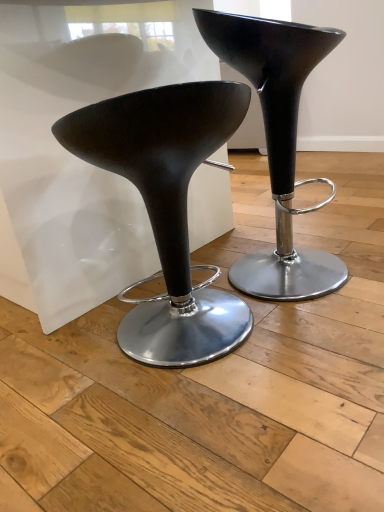
Question: From a real-world perspective, is glossy black stool at center, arranged as the second stool when viewed from the left, above or below matte black stool at center, placed as the 1th stool when sorted from left to right?

Choices:
 (A) below
 (B) above

Answer: (B)

Question: From their relative heights in the image, would you say glossy black stool at center, the 1th stool from the right, is taller or shorter than matte black stool at center, the second stool from the right?

Choices:
 (A) short
 (B) tall

Answer: (B)

Question: From the image's perspective, is glossy black stool at center, arranged as the second stool when viewed from the left, located above or below matte black stool at center, placed as the 1th stool when sorted from left to right?

Choices:
 (A) above
 (B) below

Answer: (A)

Question: Looking at their shapes, would you say matte black stool at center, placed as the 1th stool when sorted from left to right, is wider or thinner than glossy black stool at center, the 1th stool from the right?

Choices:
 (A) thin
 (B) wide

Answer: (A)

Question: Does point (148, 340) appear closer or farther from the camera than point (268, 66)?

Choices:
 (A) closer
 (B) farther

Answer: (B)

Question: Is matte black stool at center, the second stool from the right, bigger or smaller than glossy black stool at center, the 1th stool from the right?

Choices:
 (A) small
 (B) big

Answer: (A)

Question: From a real-world perspective, is matte black stool at center, the second stool from the right, above or below glossy black stool at center, the 1th stool from the right?

Choices:
 (A) below
 (B) above

Answer: (A)